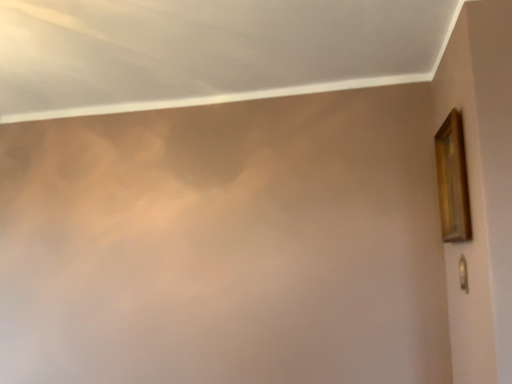
Identify the location of gold metallic picture frame at upper right. This screenshot has width=512, height=384. (452, 180).

Describe the element at coordinates (452, 180) in the screenshot. This screenshot has width=512, height=384. I see `gold metallic picture frame at upper right` at that location.

What are the coordinates of `gold metallic picture frame at upper right` in the screenshot? It's located at (452, 180).